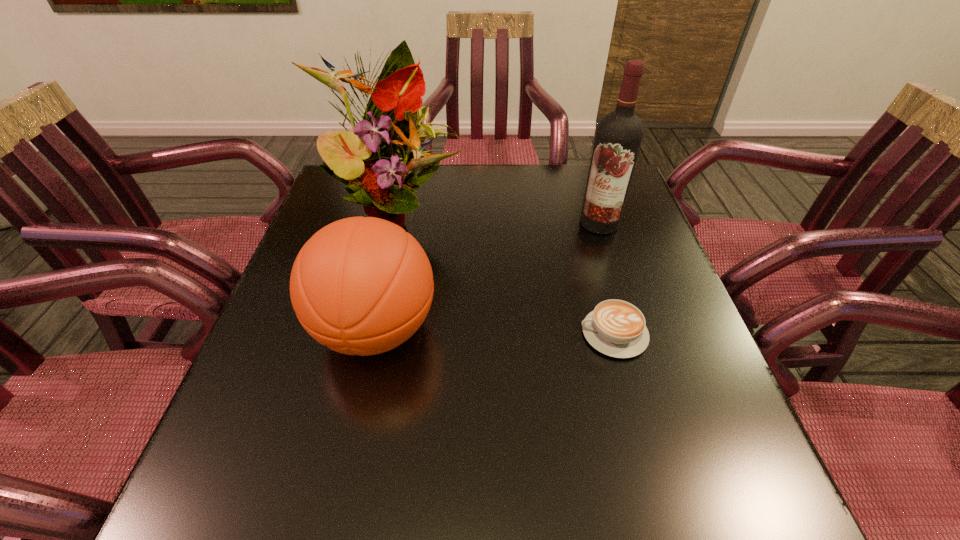
You are a GUI agent. You are given a task and a screenshot of the screen. Output one action in this format:
    pyautogui.click(x=<x>, y=<y>)
    Task: Click on the vacant region at the far edge of the desktop
    Image resolution: width=960 pixels, height=540 pixels.
    Given the screenshot: What is the action you would take?
    pyautogui.click(x=447, y=205)

In the image, there is a desktop. Where is `free space at the near edge`? free space at the near edge is located at coordinates (405, 408).

Find the location of `free space at the left edge of the desktop`. free space at the left edge of the desktop is located at coordinates (237, 388).

The image size is (960, 540). I want to click on vacant space at the right edge of the desktop, so click(680, 307).

The height and width of the screenshot is (540, 960). Find the location of `free space between the third tallest object and the wine bottle`. free space between the third tallest object and the wine bottle is located at coordinates (488, 276).

At what (x,y) coordinates should I click in order to perform the action: click on unoccupied area between the wine bottle and the cappuccino. Please return your answer as a coordinate pair (x, y). The width and height of the screenshot is (960, 540). Looking at the image, I should click on (607, 278).

Find the location of a particular element. free area in between the wine bottle and the basketball is located at coordinates (488, 276).

This screenshot has height=540, width=960. In order to click on vacant point located between the wine bottle and the shortest object in this screenshot , I will do `click(607, 278)`.

What are the coordinates of `vacant area between the wine bottle and the third tallest object` in the screenshot? It's located at tap(488, 276).

You are a GUI agent. You are given a task and a screenshot of the screen. Output one action in this format:
    pyautogui.click(x=<x>, y=<y>)
    Task: Click on the unoccupied area between the bouquet and the shortest object
    Image resolution: width=960 pixels, height=540 pixels.
    Given the screenshot: What is the action you would take?
    pyautogui.click(x=505, y=271)